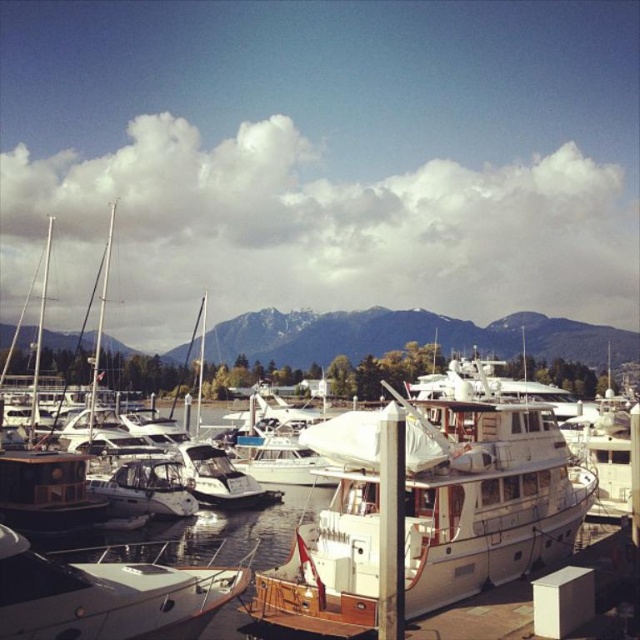
You are a dock worker who needs to ensure that both the white wood boat at center and the white glossy boat at lower left can fit into a storage area. The storage area can only accommodate boats up to the size of the smaller boat. Which boat should you prioritize storing first?

The white glossy boat at lower left should be prioritized for storage first because it is smaller than the white wood boat at center, ensuring it fits within the storage area.

You are standing on the wooden walkway in the marina and see two points marked in the scene. Which point, point (556, 556) or point (179, 595), is closer to you?

Point (556, 556) is closer to you because it is further to the viewer than point (179, 595).